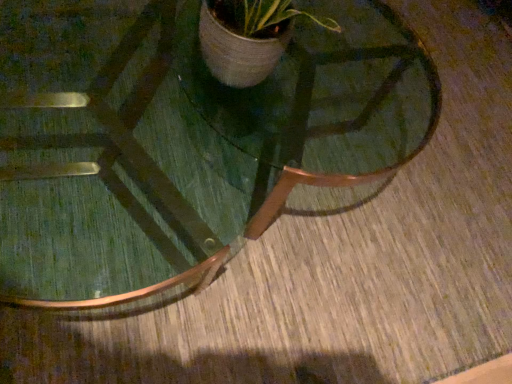
The width and height of the screenshot is (512, 384). In order to click on vacant area located to the right-hand side of green glass coffee table at center in this screenshot , I will do [x=424, y=242].